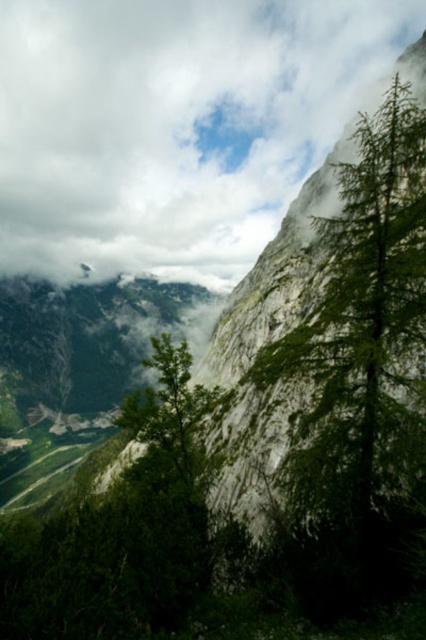
Question: Which object appears closest to the camera in this image?

Choices:
 (A) white fluffy cloud at upper center
 (B) green leafy tree at right

Answer: (B)

Question: Does white fluffy cloud at upper center come behind green leafy tree at right?

Choices:
 (A) yes
 (B) no

Answer: (A)

Question: Which point is farther to the camera?

Choices:
 (A) (411, 102)
 (B) (181, 22)

Answer: (B)

Question: Is white fluffy cloud at upper center below green leafy tree at right?

Choices:
 (A) no
 (B) yes

Answer: (A)

Question: Among these points, which one is farthest from the camera?

Choices:
 (A) click(x=344, y=464)
 (B) click(x=6, y=179)

Answer: (B)

Question: Does white fluffy cloud at upper center have a greater width compared to green leafy tree at right?

Choices:
 (A) no
 (B) yes

Answer: (B)